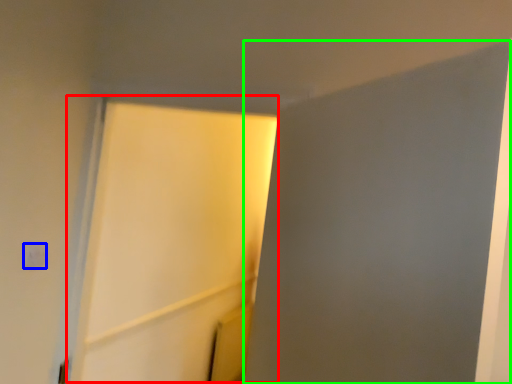
Question: Considering the real-world distances, which object is closest to screen door (highlighted by a red box)? light switch (highlighted by a blue box) or screen door (highlighted by a green box).

Choices:
 (A) light switch
 (B) screen door

Answer: (B)